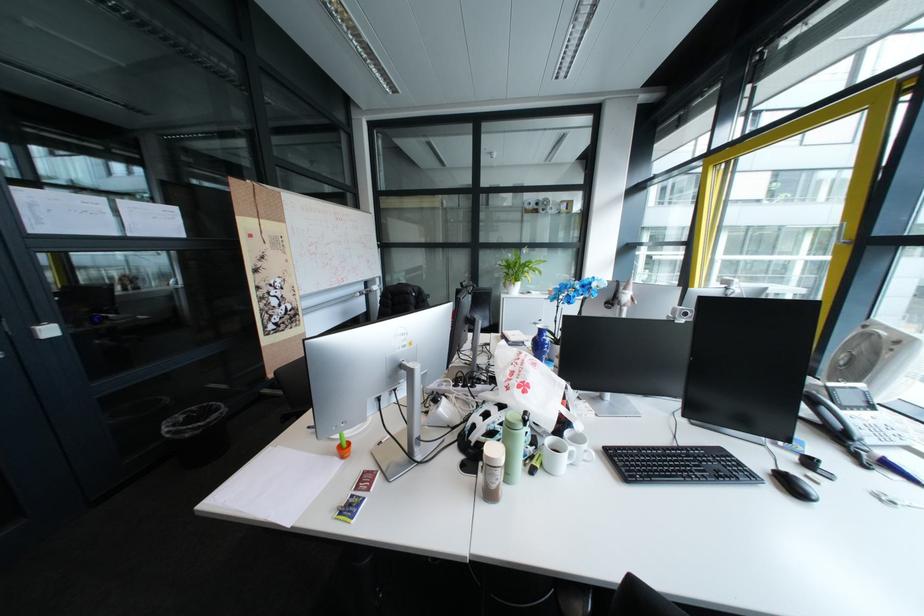
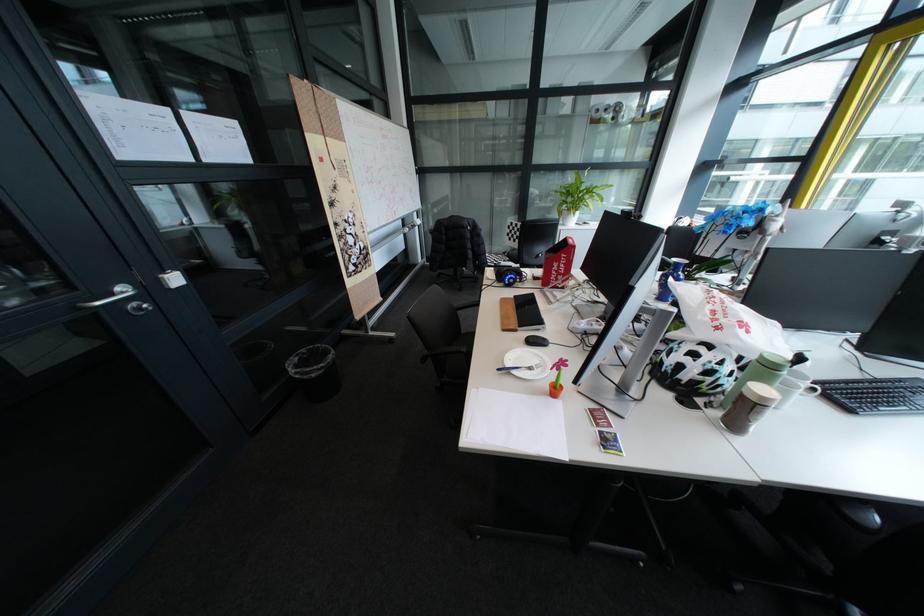
Find the pixel in the second image that matches point (322, 428) in the first image.

(513, 370)